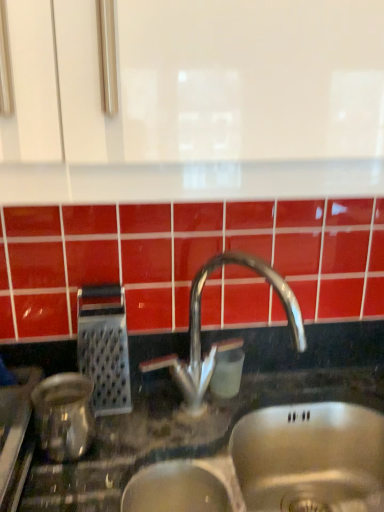
Question: Considering the relative sizes of metallic grater at left, which ranks as the second appliance in front-to-back order, and polished metallic faucet at center in the image provided, is metallic grater at left, which ranks as the second appliance in front-to-back order, thinner than polished metallic faucet at center?

Choices:
 (A) no
 (B) yes

Answer: (B)

Question: Considering the relative sizes of metallic grater at left, which ranks as the second appliance in front-to-back order, and polished metallic faucet at center in the image provided, is metallic grater at left, which ranks as the second appliance in front-to-back order, taller than polished metallic faucet at center?

Choices:
 (A) yes
 (B) no

Answer: (B)

Question: Are metallic grater at left, which ranks as the second appliance in front-to-back order, and polished metallic faucet at center located far from each other?

Choices:
 (A) no
 (B) yes

Answer: (A)

Question: Is metallic grater at left, the 1th appliance viewed from the back, turned away from polished metallic faucet at center?

Choices:
 (A) no
 (B) yes

Answer: (A)

Question: Does metallic grater at left, the 1th appliance viewed from the back, have a lesser height compared to polished metallic faucet at center?

Choices:
 (A) yes
 (B) no

Answer: (A)

Question: Are metallic grater at left, the 1th appliance viewed from the back, and polished metallic faucet at center beside each other?

Choices:
 (A) yes
 (B) no

Answer: (B)

Question: Is polished metallic faucet at center shorter than shiny metallic kettle at left, positioned as the 2th appliance in back-to-front order?

Choices:
 (A) no
 (B) yes

Answer: (A)

Question: Is the surface of polished metallic faucet at center in direct contact with shiny metallic kettle at left, positioned as the 2th appliance in back-to-front order?

Choices:
 (A) no
 (B) yes

Answer: (A)

Question: Is polished metallic faucet at center thinner than shiny metallic kettle at left, positioned as the 2th appliance in back-to-front order?

Choices:
 (A) yes
 (B) no

Answer: (A)

Question: From the image's perspective, is polished metallic faucet at center below shiny metallic kettle at left, positioned as the 2th appliance in back-to-front order?

Choices:
 (A) yes
 (B) no

Answer: (B)

Question: Is polished metallic faucet at center positioned with its back to shiny metallic kettle at left, the 1th appliance positioned from the front?

Choices:
 (A) yes
 (B) no

Answer: (B)

Question: Is the depth of polished metallic faucet at center less than that of shiny metallic kettle at left, the 1th appliance positioned from the front?

Choices:
 (A) yes
 (B) no

Answer: (B)

Question: Is metallic grater at left, the 1th appliance viewed from the back, outside shiny metallic kettle at left, positioned as the 2th appliance in back-to-front order?

Choices:
 (A) no
 (B) yes

Answer: (B)